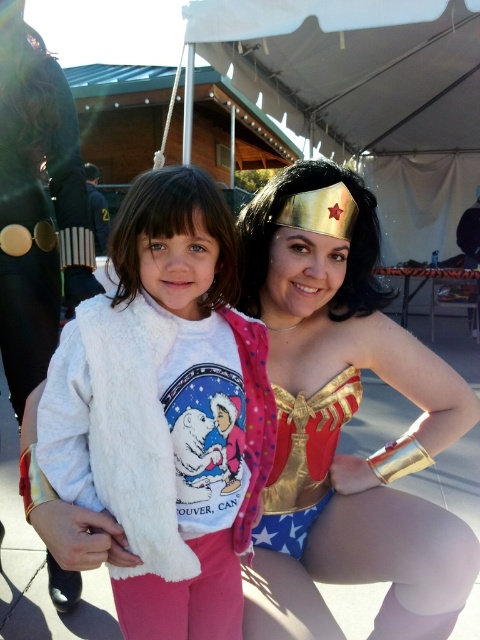
Question: Which point appears closest to the camera in this image?

Choices:
 (A) tap(201, 532)
 (B) tap(345, 296)

Answer: (A)

Question: Which point is closer to the camera taking this photo?

Choices:
 (A) (191, 205)
 (B) (264, 198)

Answer: (A)

Question: Is gold metallic costume at center wider than white fluffy vest at center?

Choices:
 (A) yes
 (B) no

Answer: (A)

Question: From the image, what is the correct spatial relationship of gold metallic costume at center in relation to white fluffy vest at center?

Choices:
 (A) above
 (B) below

Answer: (B)

Question: Can you confirm if gold metallic costume at center is positioned to the left of white fluffy vest at center?

Choices:
 (A) no
 (B) yes

Answer: (A)